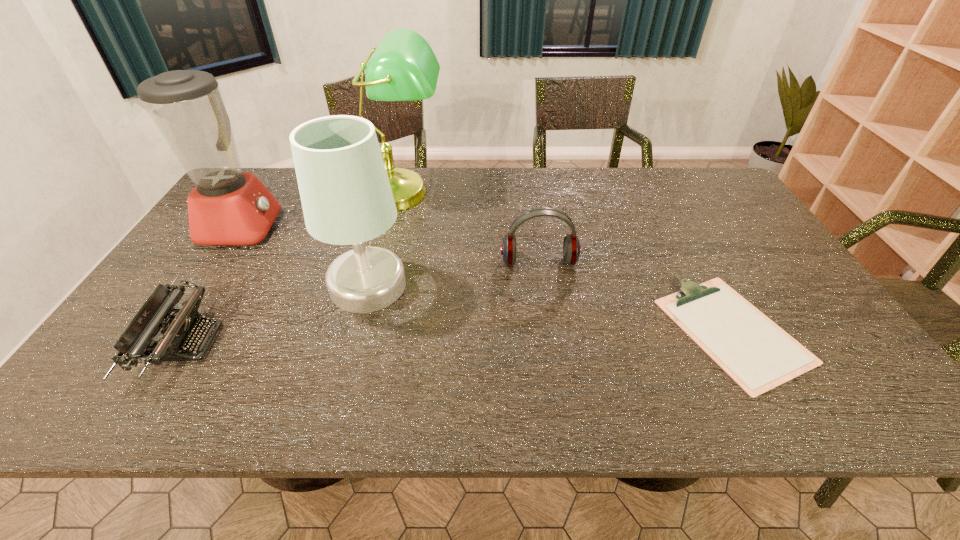
In order to click on vacant space located on the base of the lampshade in this screenshot , I will do `click(522, 285)`.

This screenshot has height=540, width=960. In order to click on vacant area situated 0.290m on the ear cups of the fourth tallest object in this screenshot , I will do `click(553, 361)`.

Locate an element on the screen. The height and width of the screenshot is (540, 960). vacant space located on the typing side of the second shortest object is located at coordinates (350, 343).

The height and width of the screenshot is (540, 960). Identify the location of vacant area situated 0.100m on the back of the clipboard. (691, 254).

Find the location of a particular element. This screenshot has height=540, width=960. lamp that is at the far edge is located at coordinates (403, 67).

The height and width of the screenshot is (540, 960). I want to click on blender located in the far edge section of the desktop, so click(227, 207).

The width and height of the screenshot is (960, 540). I want to click on typewriter that is at the near edge, so click(x=178, y=332).

You are a GUI agent. You are given a task and a screenshot of the screen. Output one action in this format:
    pyautogui.click(x=<x>, y=<y>)
    Task: Click on the clipboard located at the near edge
    
    Given the screenshot: What is the action you would take?
    pyautogui.click(x=756, y=353)

What are the coordinates of `blender that is at the left edge` in the screenshot? It's located at (227, 207).

At what (x,y) coordinates should I click in order to perform the action: click on typewriter at the left edge. Please return your answer as a coordinate pair (x, y). Image resolution: width=960 pixels, height=540 pixels. Looking at the image, I should click on (178, 332).